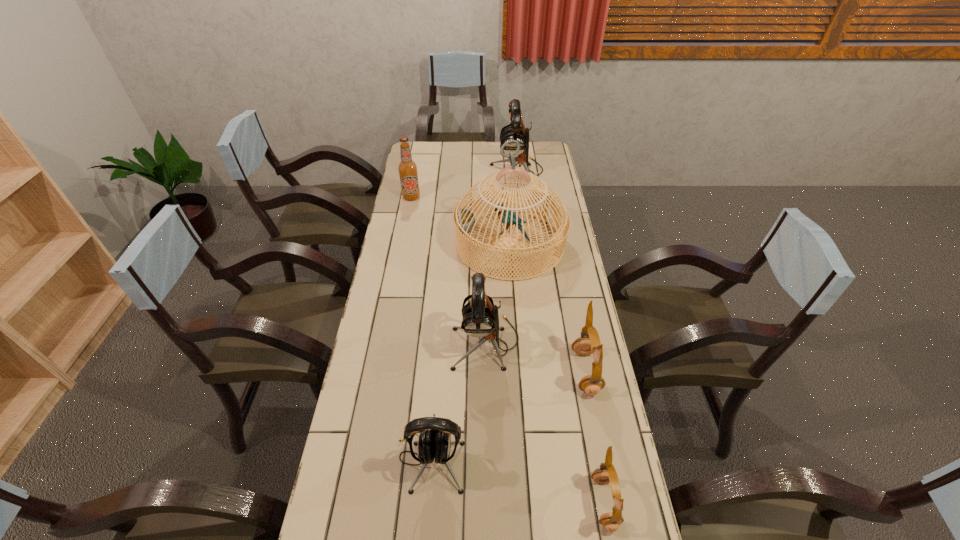
Locate which black earphone is the second closest to the nearer brown earphone. Please provide its 2D coordinates. Your answer should be formatted as a tuple, i.e. [(x, y)], where the tuple contains the x and y coordinates of a point satisfying the conditions above.

[(480, 316)]

Locate which black earphone is the closest to the second smallest black earphone. Please provide its 2D coordinates. Your answer should be formatted as a tuple, i.e. [(x, y)], where the tuple contains the x and y coordinates of a point satisfying the conditions above.

[(435, 443)]

This screenshot has height=540, width=960. In order to click on vacant region that satisfies the following two spatial constraints: 1. on the back side of the second tallest object; 2. on the right side of the third farthest object in this screenshot , I will do `click(504, 172)`.